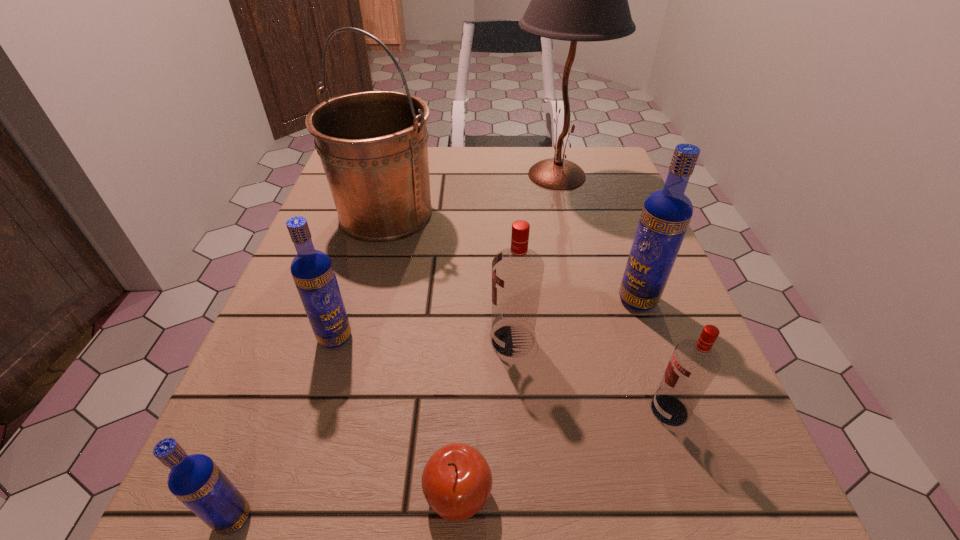
Image resolution: width=960 pixels, height=540 pixels. I want to click on empty space that is in between the third vodka from left to right and the smaller red vodka, so click(590, 375).

Identify which object is the fifth nearest to the third nearest object. Please provide its 2D coordinates. Your answer should be formatted as a tuple, i.e. [(x, y)], where the tuple contains the x and y coordinates of a point satisfying the conditions above.

[(373, 146)]

Where is `object that is the closest to the bucket`? The width and height of the screenshot is (960, 540). object that is the closest to the bucket is located at coordinates (585, 0).

At what (x,y) coordinates should I click in order to perform the action: click on the second closest vodka to the farther red vodka. Please return your answer as a coordinate pair (x, y). Image resolution: width=960 pixels, height=540 pixels. Looking at the image, I should click on (694, 363).

Locate an element on the screen. the third closest vodka to the fourth vodka from right to left is located at coordinates (666, 214).

Locate an element on the screen. the second closest blue vodka to the fourth farthest vodka is located at coordinates (312, 270).

Identify the location of blue vodka that stands as the closest to the nearer red vodka. (666, 214).

At what (x,y) coordinates should I click in order to perform the action: click on free space that satisfies the following two spatial constraints: 1. on the front-facing side of the table lamp; 2. on the back side of the farthest vodka. Please return your answer as a coordinate pair (x, y). This screenshot has width=960, height=540. Looking at the image, I should click on (588, 300).